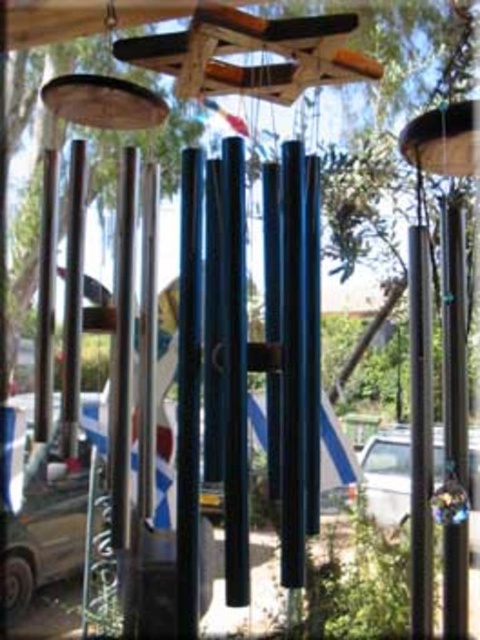
Is point (56, 566) positioned in front of point (471, 552)?

No, (56, 566) is behind (471, 552).

Is point (59, 474) behind point (471, 440)?

Yes, point (59, 474) is behind point (471, 440).

Where is `metallic silver car at lower left`? This screenshot has height=640, width=480. metallic silver car at lower left is located at coordinates (47, 529).

In the scene shown: Is polished metal pole at center taller than white glossy car at center?

Indeed, polished metal pole at center has a greater height compared to white glossy car at center.

What do you see at coordinates (420, 435) in the screenshot? Image resolution: width=480 pixels, height=640 pixels. I see `polished metal pole at center` at bounding box center [420, 435].

Where is `polished metal pole at center`? This screenshot has width=480, height=640. polished metal pole at center is located at coordinates (420, 435).

Is point (445, 416) less distant than point (422, 536)?

No, it is not.

Can you confirm if black polished pole at right is positioned below polished metal pole at center?

Incorrect, black polished pole at right is not positioned below polished metal pole at center.

Describe the element at coordinates (455, 339) in the screenshot. The image size is (480, 640). I see `black polished pole at right` at that location.

The image size is (480, 640). Identify the location of black polished pole at right. (455, 339).